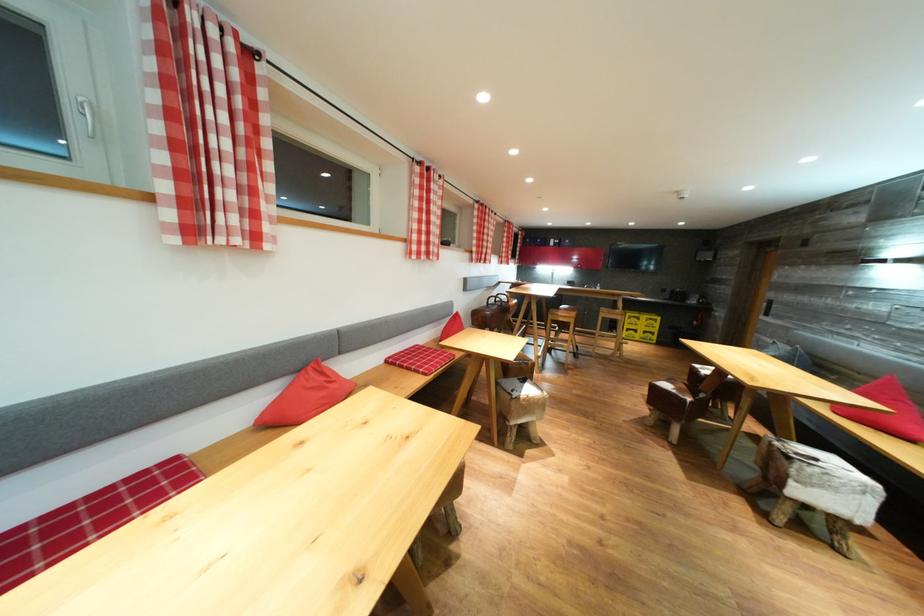
Describe the element at coordinates (86, 114) in the screenshot. I see `a white window handle` at that location.